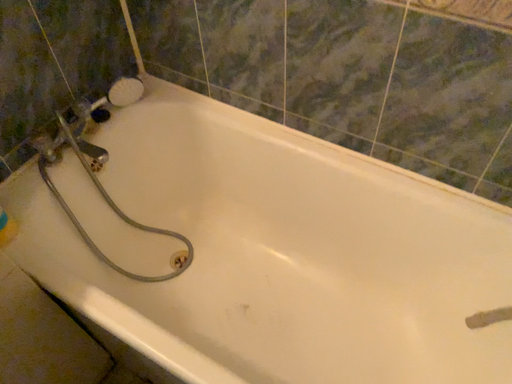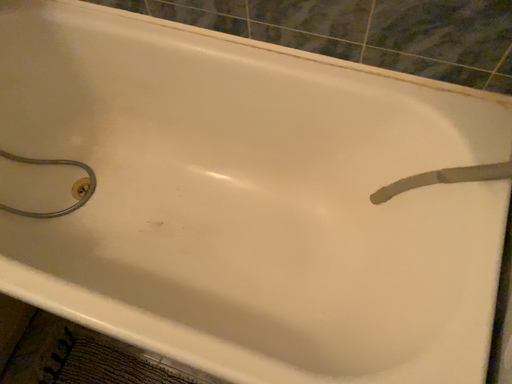
Question: Which way did the camera rotate in the video?

Choices:
 (A) rotated downward
 (B) rotated upward

Answer: (A)